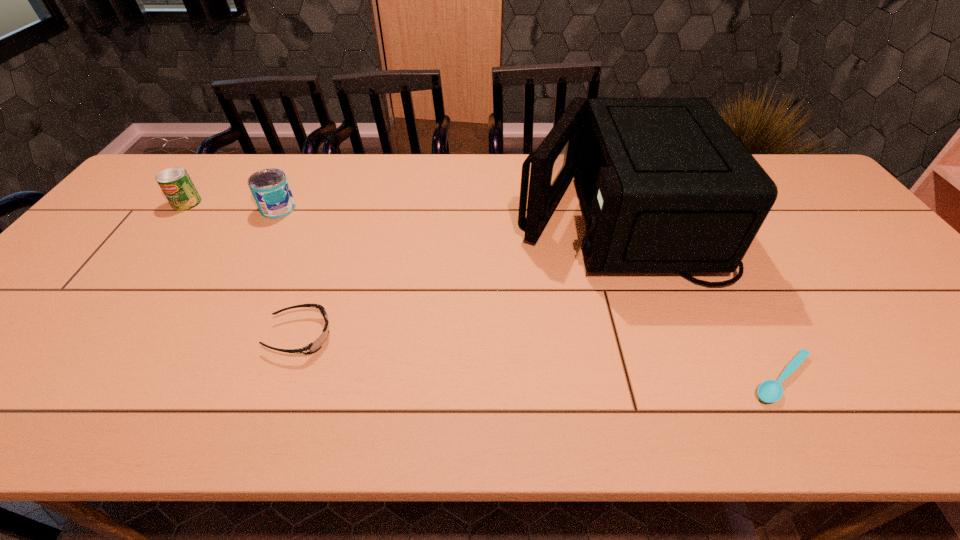
The height and width of the screenshot is (540, 960). In order to click on the tallest object in this screenshot , I will do (x=666, y=186).

Identify the location of the right can. (269, 187).

You are a GUI agent. You are given a task and a screenshot of the screen. Output one action in this format:
    pyautogui.click(x=<x>, y=<y>)
    Task: Click on the left can
    
    Given the screenshot: What is the action you would take?
    pyautogui.click(x=176, y=184)

Where is `the third object from left to right`? The height and width of the screenshot is (540, 960). the third object from left to right is located at coordinates (311, 348).

The width and height of the screenshot is (960, 540). Find the location of `sunglasses`. sunglasses is located at coordinates (311, 348).

This screenshot has height=540, width=960. What are the coordinates of `spoon` in the screenshot? It's located at (769, 391).

This screenshot has height=540, width=960. I want to click on free space located 0.060m with the door open on the tallest object, so click(x=493, y=215).

You are a GUI agent. You are given a task and a screenshot of the screen. Output one action in this format:
    pyautogui.click(x=<x>, y=<y>)
    Task: Click on the vacant space situated with the door open on the tallest object
    
    Given the screenshot: What is the action you would take?
    pyautogui.click(x=388, y=215)

This screenshot has width=960, height=540. Find the location of `blank space located with the door open on the tallest object`. blank space located with the door open on the tallest object is located at coordinates (429, 215).

Find the location of a particular element. The image size is (960, 540). free location located on the back of the right can is located at coordinates (290, 185).